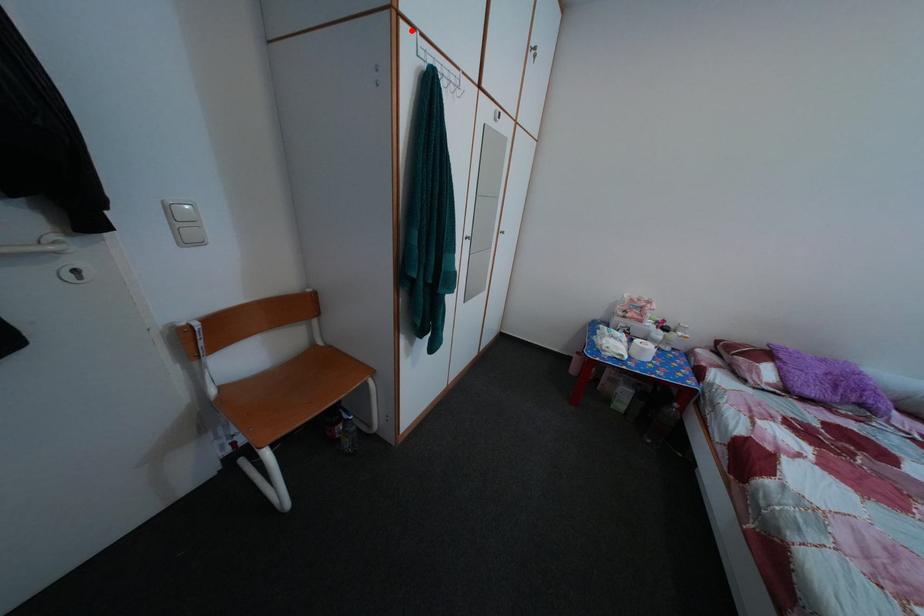
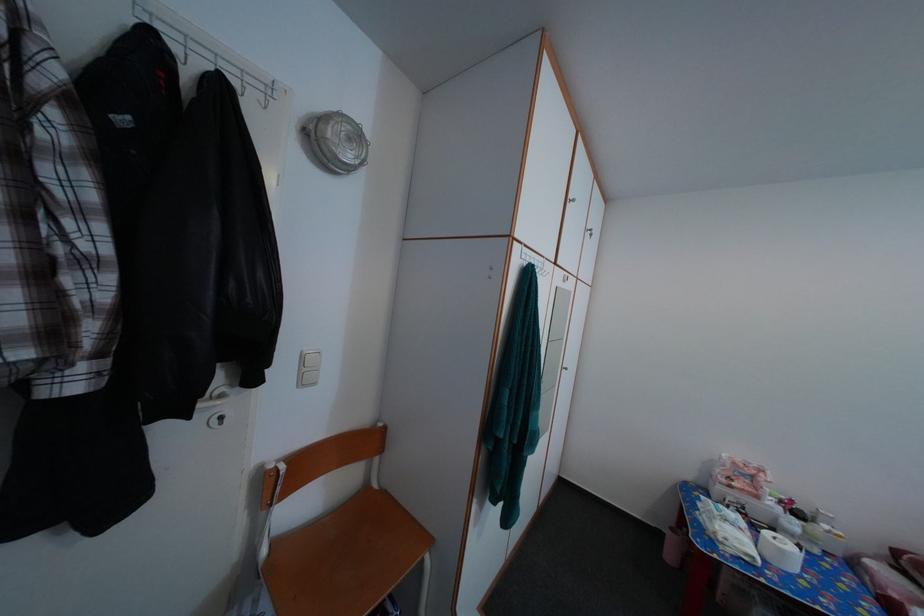
Question: I am providing you with two images of the same scene from different viewpoints. A red point is marked on the first image. Is the red point's position out of view in image 2?

Choices:
 (A) Yes
 (B) No

Answer: (B)